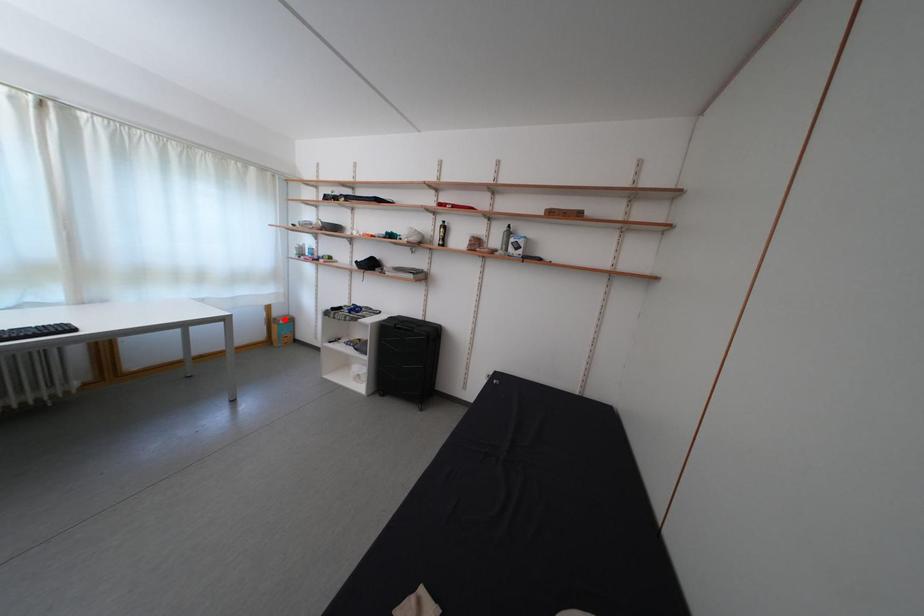
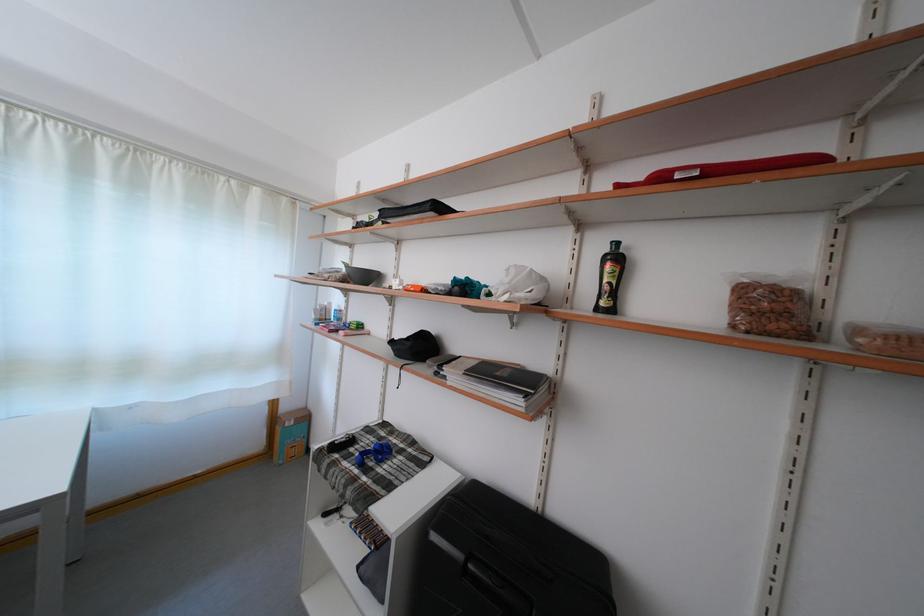
Question: I am providing you with two images of the same scene from different viewpoints. In image1, a red point is highlighted. Considering the same 3D point in image2, which of the following is correct?

Choices:
 (A) It is closer
 (B) It is farther

Answer: (A)